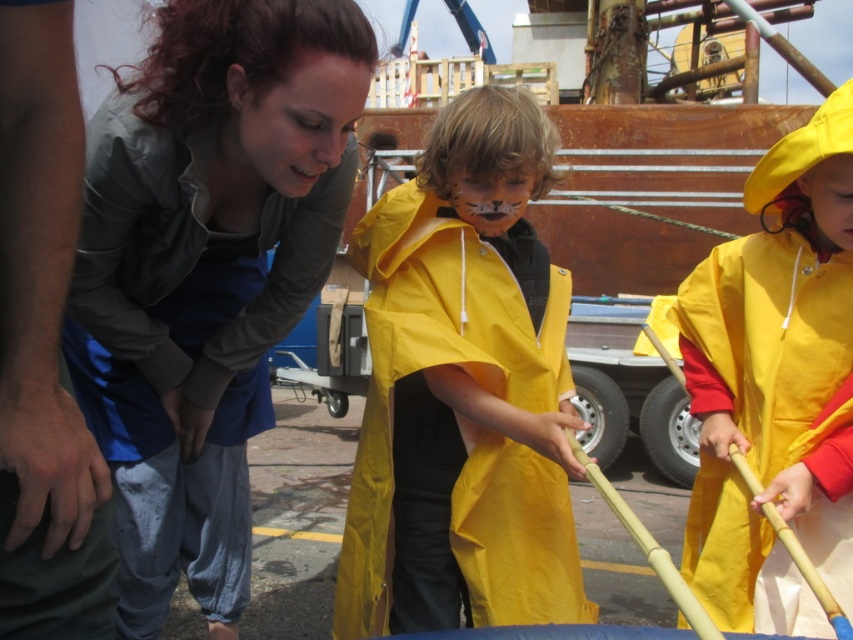
Does matte yellow raincoat at center have a lesser height compared to yellow matte raincoat at right?

No, matte yellow raincoat at center is not shorter than yellow matte raincoat at right.

Can you confirm if matte yellow raincoat at center is taller than yellow matte raincoat at right?

Indeed, matte yellow raincoat at center has a greater height compared to yellow matte raincoat at right.

Is point (553, 369) positioned before point (756, 168)?

No.

You are a GUI agent. You are given a task and a screenshot of the screen. Output one action in this format:
    pyautogui.click(x=<x>, y=<y>)
    Task: Click on the matte yellow raincoat at center
    This screenshot has width=853, height=640.
    Given the screenshot: What is the action you would take?
    pyautogui.click(x=463, y=390)

Between matte gray jacket at upper left and matte yellow raincoat at center, which one has more height?

With more height is matte gray jacket at upper left.

Describe the element at coordinates (206, 273) in the screenshot. I see `matte gray jacket at upper left` at that location.

Who is more forward, (262, 284) or (396, 472)?

Point (396, 472)

Identify the location of matte gray jacket at upper left. This screenshot has height=640, width=853. (206, 273).

Between matte gray jacket at upper left and yellow matte raincoat at right, which one is positioned higher?

matte gray jacket at upper left

Can you confirm if matte gray jacket at upper left is thinner than yellow matte raincoat at right?

In fact, matte gray jacket at upper left might be wider than yellow matte raincoat at right.

Locate an element on the screen. matte gray jacket at upper left is located at coordinates (206, 273).